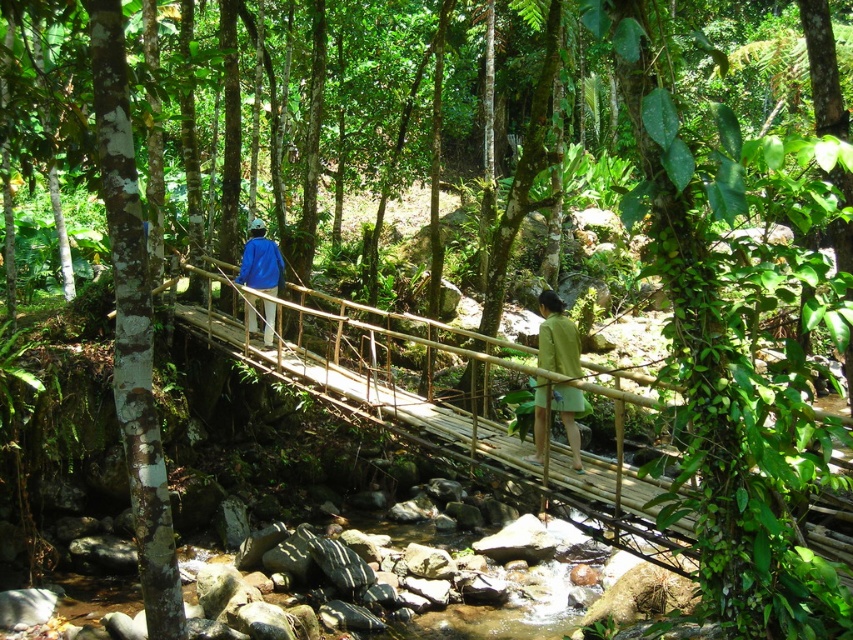
Which is more to the right, green matte skirt at center or blue fabric jacket at center?

green matte skirt at center is more to the right.

Measure the distance between point (544,419) and camera.

A distance of 6.30 meters exists between point (544,419) and camera.

You are a GUI agent. You are given a task and a screenshot of the screen. Output one action in this format:
    pyautogui.click(x=<x>, y=<y>)
    Task: Click on the green matte skirt at center
    This screenshot has height=640, width=853.
    Given the screenshot: What is the action you would take?
    pyautogui.click(x=556, y=337)